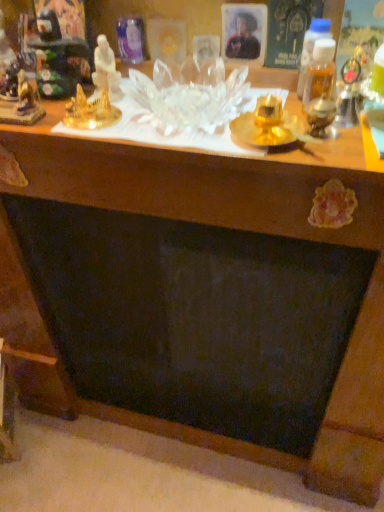
Where is `white porcelain statue at upper left, placed as the 4th toy when sorted from left to right`? The image size is (384, 512). white porcelain statue at upper left, placed as the 4th toy when sorted from left to right is located at coordinates (97, 94).

Find the location of a particular element. The image size is (384, 512). metallic gold figurine at upper left, the 3th toy from the right is located at coordinates (59, 58).

Identify the location of matte black portrait at upper center. (244, 39).

Locate an element on the screen. This screenshot has width=384, height=512. gold metallic statue at upper left, the 1th toy positioned from the left is located at coordinates (21, 104).

This screenshot has height=512, width=384. Identify the location of transparent glass table at upper center. (192, 184).

The image size is (384, 512). Identify the location of white porcelain statue at upper left, the 1th toy viewed from the right. (97, 94).

From the picture: Considering the sizes of gold metallic statue at upper left, acting as the 2th toy starting from the right, and white porcelain statue at upper left, the 1th toy viewed from the right, in the image, is gold metallic statue at upper left, acting as the 2th toy starting from the right, taller or shorter than white porcelain statue at upper left, the 1th toy viewed from the right,?

Clearly, gold metallic statue at upper left, acting as the 2th toy starting from the right, is shorter compared to white porcelain statue at upper left, the 1th toy viewed from the right.

From the image's perspective, between gold metallic statue at upper left, the 3th toy in the left-to-right sequence, and white porcelain statue at upper left, the 1th toy viewed from the right, who is located below?

gold metallic statue at upper left, the 3th toy in the left-to-right sequence, is shown below in the image.

Who is more distant, gold metallic statue at upper left, acting as the 2th toy starting from the right, or white porcelain statue at upper left, the 1th toy viewed from the right?

white porcelain statue at upper left, the 1th toy viewed from the right, is behind.

Can you confirm if matte black portrait at upper center is shorter than transparent glass table at upper center?

No, matte black portrait at upper center is not shorter than transparent glass table at upper center.

Could you tell me if matte black portrait at upper center is facing transparent glass table at upper center?

No, matte black portrait at upper center is not oriented towards transparent glass table at upper center.

Could transparent glass table at upper center be considered to be inside matte black portrait at upper center?

No, transparent glass table at upper center is not inside matte black portrait at upper center.

Does matte black portrait at upper center come behind transparent glass table at upper center?

Yes.

Is point (261, 189) closer to viewer compared to point (84, 118)?

That is False.

Considering the relative positions of transparent glass table at upper center and white porcelain statue at upper left, placed as the 4th toy when sorted from left to right, in the image provided, is transparent glass table at upper center to the left or to the right of white porcelain statue at upper left, placed as the 4th toy when sorted from left to right,?

transparent glass table at upper center is positioned on white porcelain statue at upper left, placed as the 4th toy when sorted from left to right,'s right side.

Is transparent glass table at upper center turned away from white porcelain statue at upper left, the 1th toy viewed from the right?

No, transparent glass table at upper center is not facing away from white porcelain statue at upper left, the 1th toy viewed from the right.

In terms of height, does transparent glass table at upper center look taller or shorter compared to white porcelain statue at upper left, placed as the 4th toy when sorted from left to right?

transparent glass table at upper center is shorter than white porcelain statue at upper left, placed as the 4th toy when sorted from left to right.

In the scene shown: From a real-world perspective, is gold metallic statue at upper left, acting as the 2th toy starting from the right, physically below metallic gold figurine at upper left, the 3th toy from the right?

Indeed, from a real-world perspective, gold metallic statue at upper left, acting as the 2th toy starting from the right, is positioned beneath metallic gold figurine at upper left, the 3th toy from the right.

Would you say gold metallic statue at upper left, acting as the 2th toy starting from the right, is outside metallic gold figurine at upper left, which is the second toy in left-to-right order?

gold metallic statue at upper left, acting as the 2th toy starting from the right, is positioned outside metallic gold figurine at upper left, which is the second toy in left-to-right order.

From the image's perspective, which object appears higher, gold metallic statue at upper left, the 3th toy in the left-to-right sequence, or metallic gold figurine at upper left, the 3th toy from the right?

metallic gold figurine at upper left, the 3th toy from the right, is shown above in the image.

The image size is (384, 512). In order to click on the 3rd toy behind the gold metallic statue at upper left, acting as the 2th toy starting from the right in this screenshot , I will do `click(59, 58)`.

Between gold metallic statue at upper left, placed as the fourth toy when sorted from right to left, and gold metallic statue at upper left, acting as the 2th toy starting from the right, which one has more height?

Standing taller between the two is gold metallic statue at upper left, placed as the fourth toy when sorted from right to left.

Is gold metallic statue at upper left, placed as the fourth toy when sorted from right to left, smaller than gold metallic statue at upper left, acting as the 2th toy starting from the right?

Incorrect, gold metallic statue at upper left, placed as the fourth toy when sorted from right to left, is not smaller in size than gold metallic statue at upper left, acting as the 2th toy starting from the right.

Is gold metallic statue at upper left, placed as the fourth toy when sorted from right to left, thinner than gold metallic statue at upper left, the 3th toy in the left-to-right sequence?

Correct, the width of gold metallic statue at upper left, placed as the fourth toy when sorted from right to left, is less than that of gold metallic statue at upper left, the 3th toy in the left-to-right sequence.

Would you say metallic gold figurine at upper left, which is the second toy in left-to-right order, is to the left or to the right of matte black portrait at upper center in the picture?

Clearly, metallic gold figurine at upper left, which is the second toy in left-to-right order, is on the left of matte black portrait at upper center in the image.

Which is in front, metallic gold figurine at upper left, the 3th toy from the right, or matte black portrait at upper center?

Positioned in front is metallic gold figurine at upper left, the 3th toy from the right.

What's the angular difference between metallic gold figurine at upper left, which is the second toy in left-to-right order, and matte black portrait at upper center's facing directions?

4.78 degrees.

How distant is metallic gold figurine at upper left, which is the second toy in left-to-right order, from matte black portrait at upper center?

The distance of metallic gold figurine at upper left, which is the second toy in left-to-right order, from matte black portrait at upper center is 10.74 inches.

Measure the distance between gold metallic statue at upper left, the 1th toy positioned from the left, and matte black portrait at upper center.

gold metallic statue at upper left, the 1th toy positioned from the left, and matte black portrait at upper center are 13.09 inches apart from each other.

In the scene shown: Looking at the image, does gold metallic statue at upper left, the 1th toy positioned from the left, seem bigger or smaller compared to matte black portrait at upper center?

Clearly, gold metallic statue at upper left, the 1th toy positioned from the left, is larger in size than matte black portrait at upper center.

Who is taller, gold metallic statue at upper left, the 1th toy positioned from the left, or matte black portrait at upper center?

matte black portrait at upper center is taller.

Locate an element on the screen. The image size is (384, 512). toy lying on the right of gold metallic statue at upper left, acting as the 2th toy starting from the right is located at coordinates (97, 94).

The height and width of the screenshot is (512, 384). What are the coordinates of `table in front of the matte black portrait at upper center` in the screenshot? It's located at (192, 184).

When comparing their distances from gold metallic statue at upper left, placed as the fourth toy when sorted from right to left, does transparent glass table at upper center or white porcelain statue at upper left, placed as the 4th toy when sorted from left to right, seem further?

transparent glass table at upper center is positioned further to the anchor gold metallic statue at upper left, placed as the fourth toy when sorted from right to left.

Considering their positions, is gold metallic statue at upper left, placed as the fourth toy when sorted from right to left, positioned further to transparent glass table at upper center than gold metallic statue at upper left, the 3th toy in the left-to-right sequence?

Based on the image, gold metallic statue at upper left, placed as the fourth toy when sorted from right to left, appears to be further to transparent glass table at upper center.

When comparing their distances from metallic gold figurine at upper left, the 3th toy from the right, does transparent glass table at upper center or gold metallic statue at upper left, the 1th toy positioned from the left, seem closer?

gold metallic statue at upper left, the 1th toy positioned from the left, is positioned closer to the anchor metallic gold figurine at upper left, the 3th toy from the right.

Estimate the real-world distances between objects in this image. Which object is further from gold metallic statue at upper left, the 3th toy in the left-to-right sequence, white porcelain statue at upper left, placed as the 4th toy when sorted from left to right, or matte black portrait at upper center?

matte black portrait at upper center lies further to gold metallic statue at upper left, the 3th toy in the left-to-right sequence, than the other object.

From the image, which object appears to be nearer to gold metallic statue at upper left, the 3th toy in the left-to-right sequence, white porcelain statue at upper left, the 1th toy viewed from the right, or metallic gold figurine at upper left, the 3th toy from the right?

white porcelain statue at upper left, the 1th toy viewed from the right.

Which object lies nearer to the anchor point transparent glass table at upper center, gold metallic statue at upper left, placed as the fourth toy when sorted from right to left, or matte black portrait at upper center?

Based on the image, gold metallic statue at upper left, placed as the fourth toy when sorted from right to left, appears to be nearer to transparent glass table at upper center.

Based on the photo, from the image, which object appears to be farther from metallic gold figurine at upper left, the 3th toy from the right, gold metallic statue at upper left, the 1th toy positioned from the left, or matte black portrait at upper center?

The object further to metallic gold figurine at upper left, the 3th toy from the right, is matte black portrait at upper center.

When comparing their distances from white porcelain statue at upper left, placed as the 4th toy when sorted from left to right, does matte black portrait at upper center or gold metallic statue at upper left, the 3th toy in the left-to-right sequence, seem further?

matte black portrait at upper center lies further to white porcelain statue at upper left, placed as the 4th toy when sorted from left to right, than the other object.

Image resolution: width=384 pixels, height=512 pixels. I want to click on table located between metallic gold figurine at upper left, which is the second toy in left-to-right order, and matte black portrait at upper center in the left-right direction, so click(192, 184).

The image size is (384, 512). Find the location of `toy between gold metallic statue at upper left, placed as the fourth toy when sorted from right to left, and gold metallic statue at upper left, the 3th toy in the left-to-right sequence, from left to right`. toy between gold metallic statue at upper left, placed as the fourth toy when sorted from right to left, and gold metallic statue at upper left, the 3th toy in the left-to-right sequence, from left to right is located at coordinates (59, 58).

Find the location of a particular element. The image size is (384, 512). toy located between gold metallic statue at upper left, the 3th toy in the left-to-right sequence, and matte black portrait at upper center in the left-right direction is located at coordinates (97, 94).

You are a GUI agent. You are given a task and a screenshot of the screen. Output one action in this format:
    pyautogui.click(x=<x>, y=<y>)
    Task: Click on the table between gold metallic statue at upper left, acting as the 2th toy starting from the right, and matte black portrait at upper center from left to right
    The image size is (384, 512).
    Given the screenshot: What is the action you would take?
    pyautogui.click(x=192, y=184)